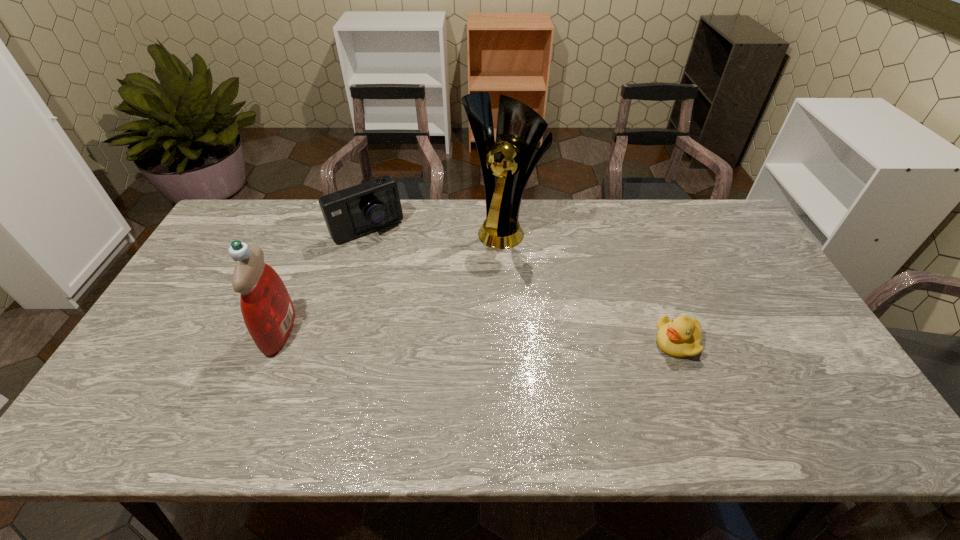
Where is `detergent`? detergent is located at coordinates (268, 312).

Where is `the rightmost object`? This screenshot has width=960, height=540. the rightmost object is located at coordinates (681, 337).

This screenshot has width=960, height=540. Find the location of `duckling`. duckling is located at coordinates (681, 337).

Where is `the third object from left to right`? This screenshot has height=540, width=960. the third object from left to right is located at coordinates (504, 164).

Where is `the tallest object`? This screenshot has width=960, height=540. the tallest object is located at coordinates (504, 164).

Where is `camera`? Image resolution: width=960 pixels, height=540 pixels. camera is located at coordinates (361, 209).

The height and width of the screenshot is (540, 960). I want to click on free space located 0.080m on the front surface of the second tallest object, so click(x=235, y=332).

Where is `free location located on the front surface of the second tallest object`? This screenshot has width=960, height=540. free location located on the front surface of the second tallest object is located at coordinates (183, 332).

The width and height of the screenshot is (960, 540). I want to click on free location located on the front surface of the second tallest object, so click(x=239, y=332).

At what (x,y) coordinates should I click in order to perform the action: click on vacant space situated 0.250m on the front-facing side of the shortest object. Please return your answer as a coordinate pair (x, y). Image resolution: width=960 pixels, height=540 pixels. Looking at the image, I should click on (561, 342).